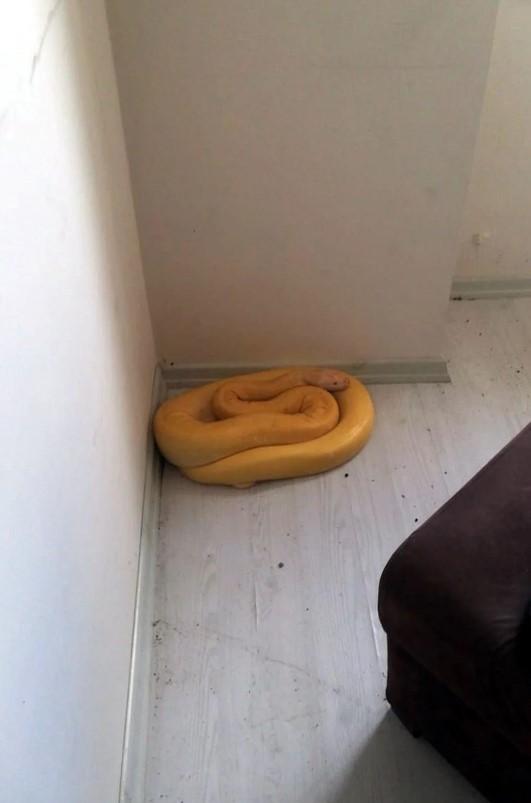
At what (x,y) coordinates should I click in order to perform the action: click on baseboard. Please return your answer as a coordinate pair (x, y). Image resolution: width=531 pixels, height=803 pixels. Looking at the image, I should click on (494, 287), (136, 732), (376, 373).